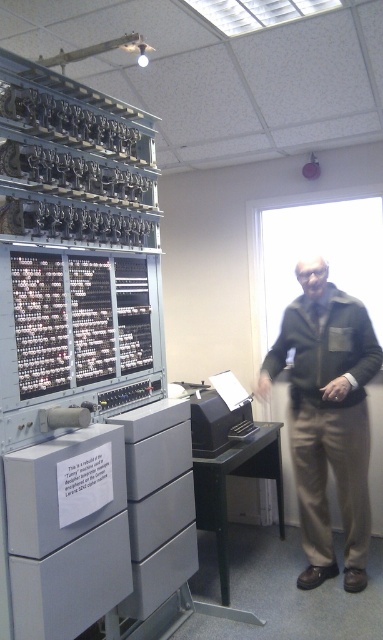
Question: Which point is closer to the camera taking this photo?

Choices:
 (A) (279, 355)
 (B) (160, 572)
 (C) (129, 492)
 (D) (152, 516)

Answer: (C)

Question: Can you confirm if khaki cotton pants at right is thinner than gray plastic drawer at center?

Choices:
 (A) no
 (B) yes

Answer: (A)

Question: Which point appears closest to the camera in this image?

Choices:
 (A) (191, 513)
 (B) (132, 497)

Answer: (B)

Question: Can you confirm if khaki cotton pants at right is smaller than satin gray drawer at center?

Choices:
 (A) no
 (B) yes

Answer: (A)

Question: Estimate the real-world distances between objects in this image. Which object is closer to the khaki cotton pants at right?

Choices:
 (A) satin gray drawer at center
 (B) gray plastic drawer at center
 (C) black plastic printer at center
 (D) gray plastic drawer at lower center

Answer: (C)

Question: In this image, where is gray plastic drawer at lower center located relative to black plastic printer at center?

Choices:
 (A) above
 (B) below

Answer: (B)